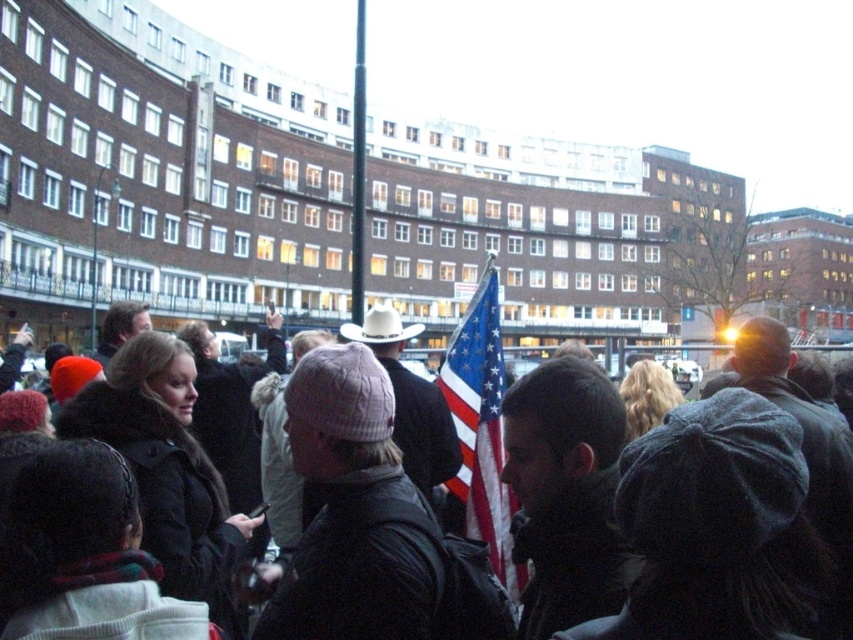
Question: Which of the following is the closest to the observer?

Choices:
 (A) (460, 321)
 (B) (746, 365)

Answer: (B)

Question: Which of the following is the farthest from the observer?

Choices:
 (A) (408, 337)
 (B) (619, 499)
 (C) (466, 449)

Answer: (A)

Question: Is matte black jacket at center below white matte cowboy hat at center?

Choices:
 (A) no
 (B) yes

Answer: (B)

Question: Is american flag at center further to the viewer compared to white matte cowboy hat at center?

Choices:
 (A) yes
 (B) no

Answer: (B)

Question: Estimate the real-world distances between objects in this image. Which object is farther from the white matte cowboy hat at center?

Choices:
 (A) matte black jacket at center
 (B) american flag at center

Answer: (A)

Question: In this image, where is matte black jacket at center located relative to american flag at center?

Choices:
 (A) right
 (B) left

Answer: (A)